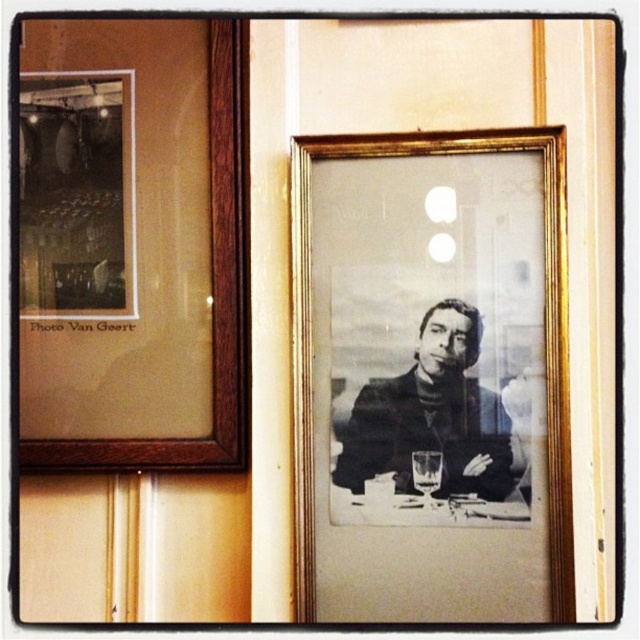
Question: In this image, where is gold metallic picture frame at center located relative to black matte portrait at center?

Choices:
 (A) below
 (B) above

Answer: (B)

Question: Among these objects, which one is farthest from the camera?

Choices:
 (A) black matte portrait at center
 (B) wooden photo frame at left
 (C) gold metallic picture frame at center

Answer: (A)

Question: Can you confirm if gold metallic picture frame at center is smaller than black matte portrait at center?

Choices:
 (A) yes
 (B) no

Answer: (B)

Question: Which is farther from the gold metallic picture frame at center?

Choices:
 (A) wooden photo frame at left
 (B) black matte portrait at center

Answer: (A)

Question: Which point appears farthest from the camera in this image?

Choices:
 (A) click(x=432, y=337)
 (B) click(x=406, y=602)
 (C) click(x=83, y=352)

Answer: (C)

Question: Is gold metallic picture frame at center smaller than black matte portrait at center?

Choices:
 (A) no
 (B) yes

Answer: (A)